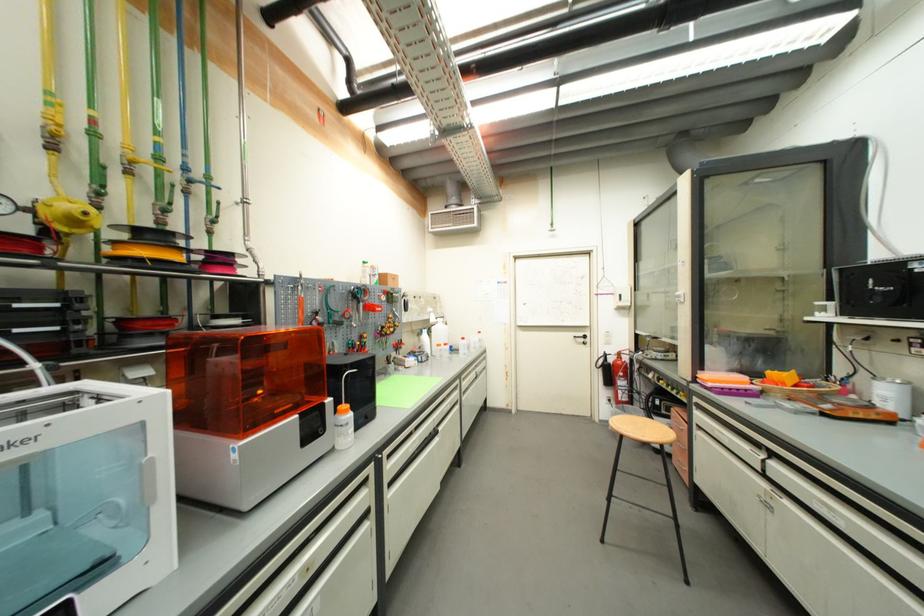
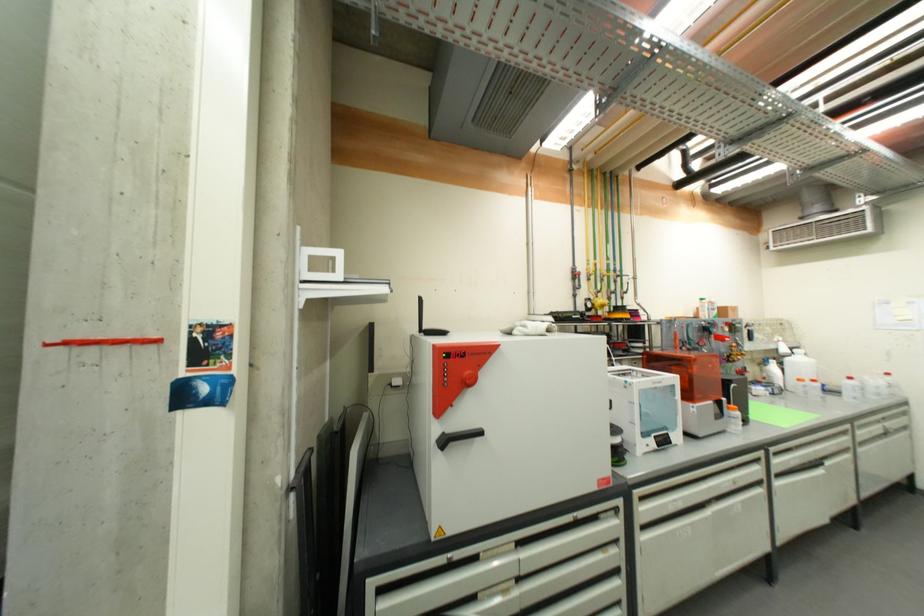
Find the pixel in the second image that matches pixel 392 483 in the first image.

(779, 472)